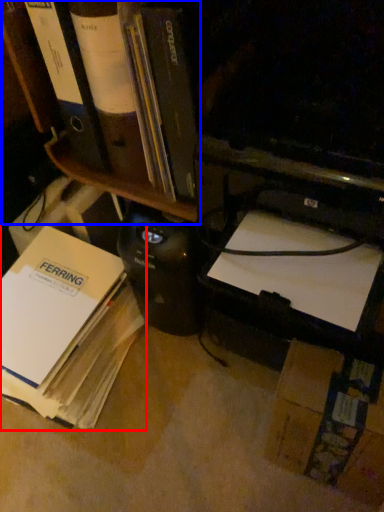
Question: Which object appears farthest to the camera in this image, book (highlighted by a red box) or bookshelf (highlighted by a blue box)?

Choices:
 (A) book
 (B) bookshelf

Answer: (A)